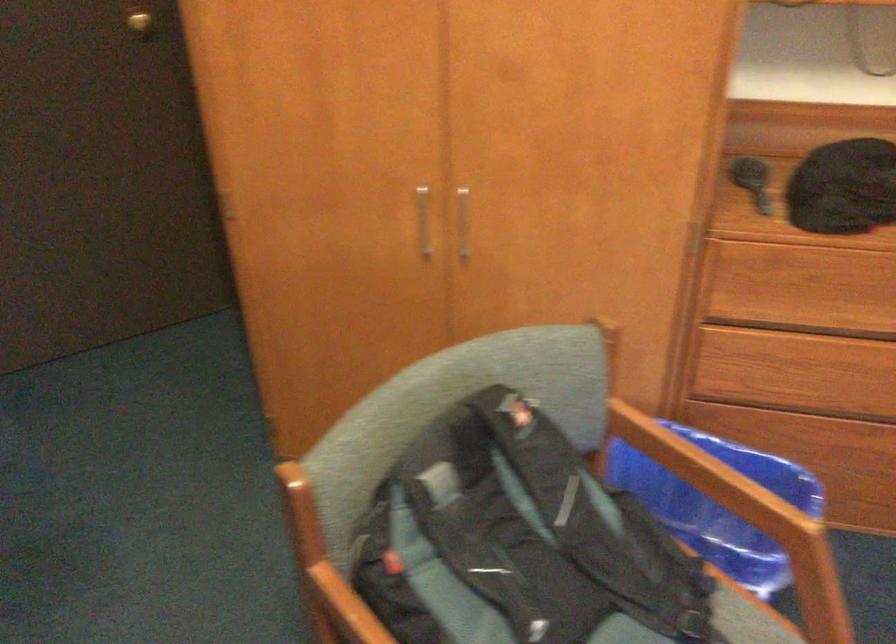
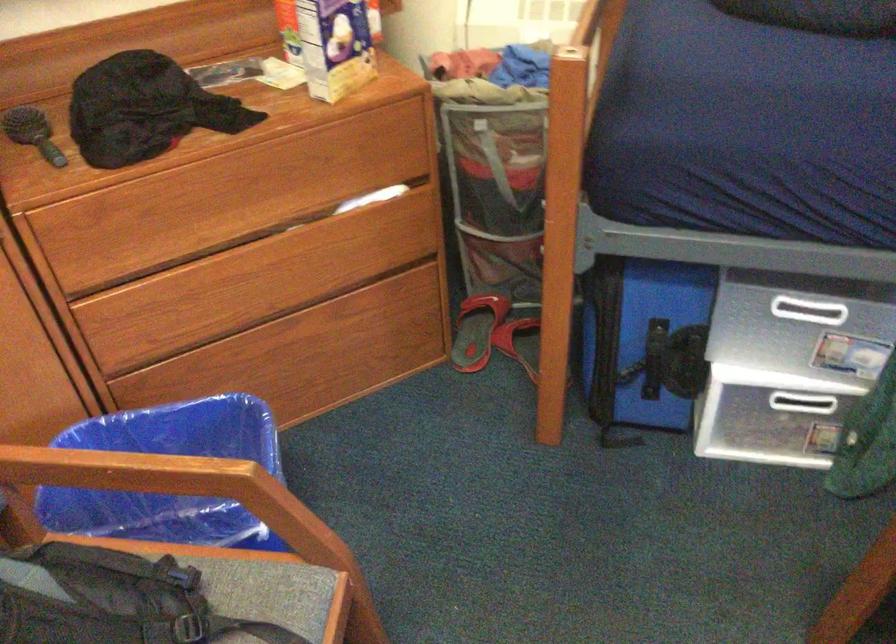
Question: The camera is either moving clockwise (left) or counter-clockwise (right) around the object. The first image is from the beginning of the video and the second image is from the end. Is the camera moving left or right when shooting the video?

Choices:
 (A) Left
 (B) Right

Answer: (A)